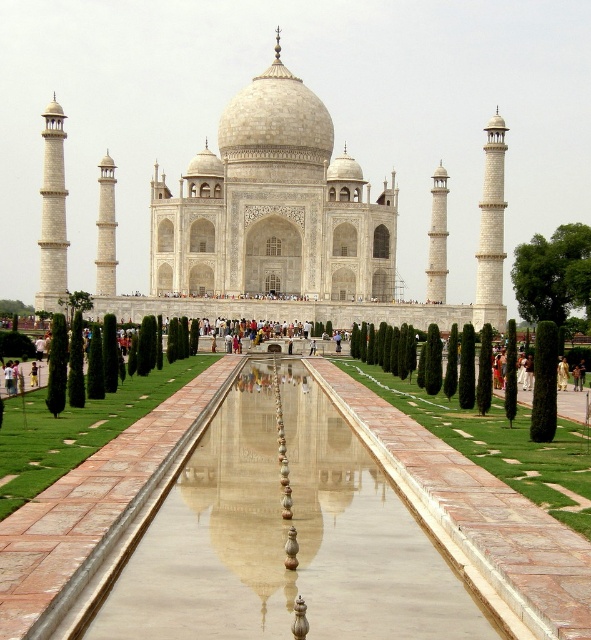
You are standing in front of the Taj Mahal and want to take a photo that includes both the main dome and its reflection in the smooth stone water at center. Based on your current position, can you see the reflection clearly?

The smooth stone water at center is located at point (284, 538), which is directly in front of the Taj Mahal. Since reflecting pools are designed to mirror structures when viewed from the optimal angle, you should be able to see the reflection clearly if you position yourself centrally and look downward toward the water surface.

You are a tourist standing in front of the Taj Mahal and want to take a photo that includes both the smooth stone water at center and the white marble taj mahal at center. Based on their positions, which one should you focus on first to ensure both are in frame?

The smooth stone water at center is in front of the white marble taj mahal at center. To include both in the photo, focus on the white marble taj mahal at center first since it is further back, allowing the smooth stone water at center in front to naturally come into the frame.

You are a tourist standing in front of the Taj Mahal and want to take a photo that includes both the smooth stone water at center and the white marble taj mahal at center. Based on their heights, which one will appear taller in your photo?

The white marble taj mahal at center will appear taller in the photo because it has a greater height than the smooth stone water at center.